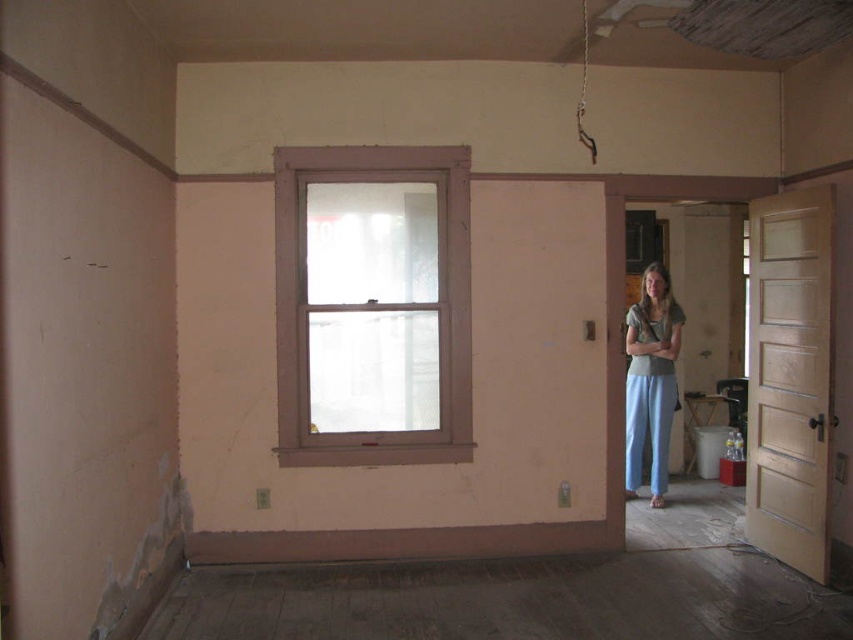
You are standing in the room and see two points marked on the wall. The first point is at coordinates point (405, 288) and the second point is at point (650, 417). Which point is closer to you?

Point (405, 288) is in front of point (650, 417), so it is closer to you.

You are a painter working in this room. You need to move the light blue cotton pants at right to the other side of the room. Can you place them under the white painted wood window at center without folding them? Please explain your reasoning based on their sizes.

The white painted wood window at center might be wider than light blue cotton pants at right. If the window is wider, there should be enough space to place the light blue cotton pants at right under it without folding since the pants are likely narrower than the window.